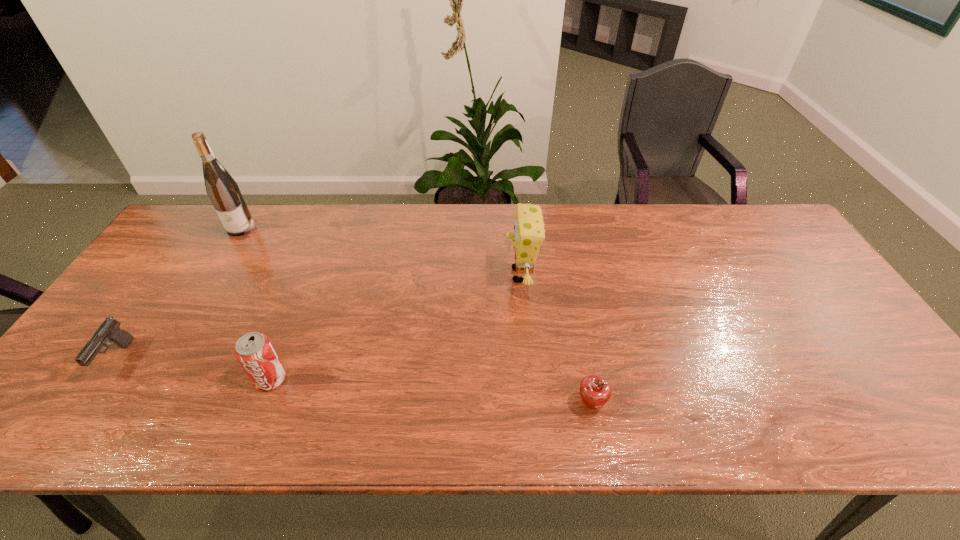
Where is `free space that satisfies the following two spatial constraints: 1. aim along the barrel of the pistol; 2. on the right side of the soda can`? The height and width of the screenshot is (540, 960). free space that satisfies the following two spatial constraints: 1. aim along the barrel of the pistol; 2. on the right side of the soda can is located at coordinates (104, 379).

You are a GUI agent. You are given a task and a screenshot of the screen. Output one action in this format:
    pyautogui.click(x=<x>, y=<y>)
    Task: Click on the free space that satisfies the following two spatial constraints: 1. on the face of the rightmost object; 2. on the right side of the fourth nearest object
    
    Given the screenshot: What is the action you would take?
    (x=532, y=404)